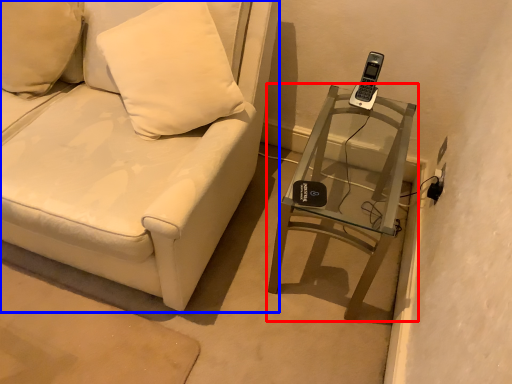
Question: Which of the following is the closest to the observer, table (highlighted by a red box) or furniture (highlighted by a blue box)?

Choices:
 (A) table
 (B) furniture

Answer: (B)